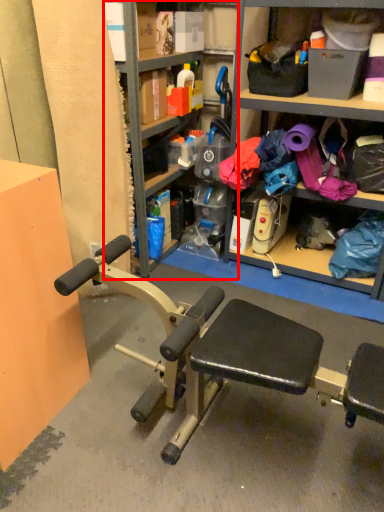
Question: From the image's perspective, where is bookshelf (annotated by the red box) located relative to shelf?

Choices:
 (A) below
 (B) above

Answer: (B)